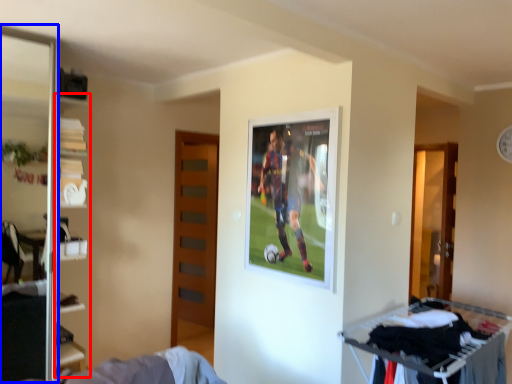
Question: Which object is closer to the camera taking this photo, bookshelf (highlighted by a red box) or screen door (highlighted by a blue box)?

Choices:
 (A) bookshelf
 (B) screen door

Answer: (B)